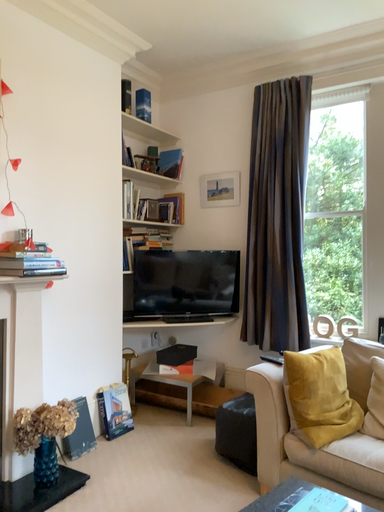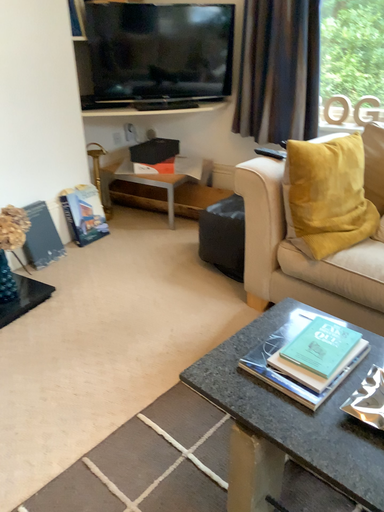
Question: Which way did the camera rotate in the video?

Choices:
 (A) rotated upward
 (B) rotated downward

Answer: (B)